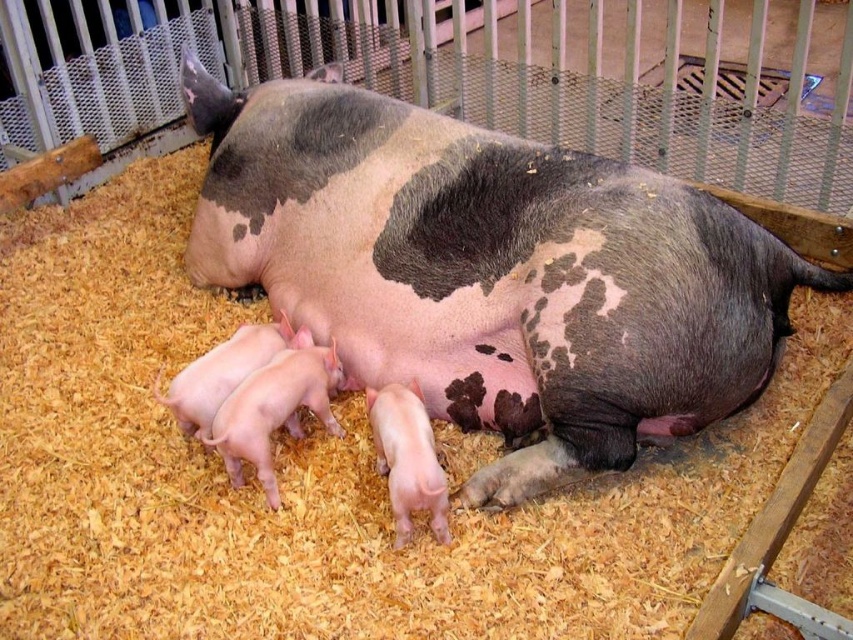
You are a farmer checking the pigpen. You notice two piglets, the pink smooth piglets at lower left and the pink smooth piglet at lower center. Which one is taller?

The pink smooth piglets at lower left is taller than the pink smooth piglet at lower center.

You are a farmer who needs to separate the speckled pink piglet at lower left from the other piglets. The pen has a movable divider that can be placed between objects. What is the minimum distance the divider needs to be to separate them?

The divider needs to be at least 2.27 meters long to separate the speckled pink piglet at lower left from the others since they are 2.27 meters apart.

You are a farmer checking the piglets in the pen. You need to identify which piglet is wider. The piglets in question are the speckled pink piglet at lower left and the pink smooth piglet at lower center. Which one is wider?

The speckled pink piglet at lower left might be wider than the pink smooth piglet at lower center.